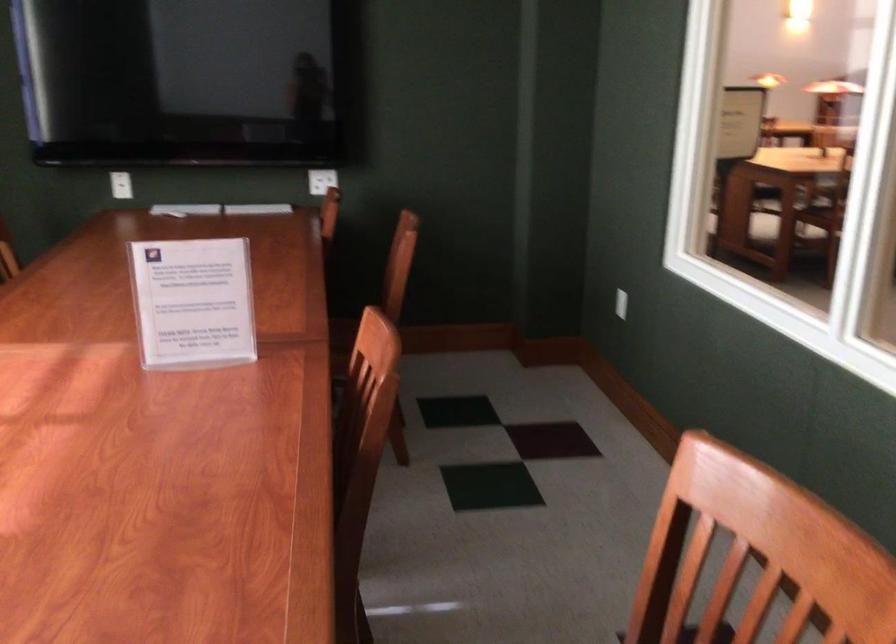
Identify the location of chair sitting surface. This screenshot has width=896, height=644. (341, 341).